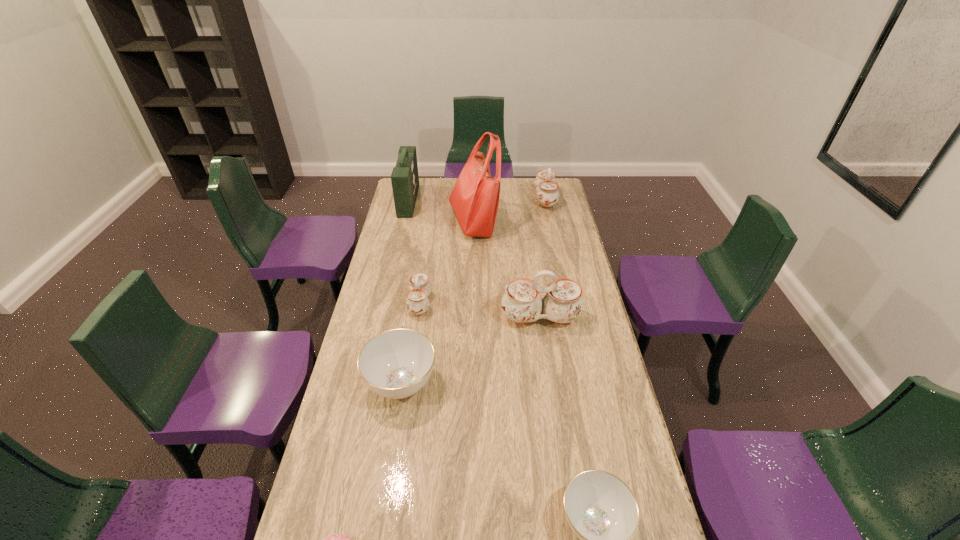
Where is `free space located on the front-facing side of the handbag`? free space located on the front-facing side of the handbag is located at coordinates (560, 222).

Find the location of a particular element. free region located 0.310m on the front-facing side of the first-aid kit is located at coordinates (475, 201).

What are the coordinates of `blank space located 0.290m by the handle of the biggest white chinaware` in the screenshot? It's located at (552, 401).

Identify the location of vacant area located by the handle of the second tallest chinaware. point(500,199).

This screenshot has width=960, height=540. I want to click on blank space located by the handle of the second tallest chinaware, so click(x=496, y=199).

This screenshot has height=540, width=960. In order to click on blank space located by the handle of the second tallest chinaware in this screenshot , I will do `click(489, 199)`.

This screenshot has width=960, height=540. Identify the location of free space located by the handle of the leftmost white chinaware. (508, 303).

At what (x,y) coordinates should I click in order to perform the action: click on free space located 0.310m on the front of the second nearest chinaware. Please return your answer as a coordinate pair (x, y). The width and height of the screenshot is (960, 540). Looking at the image, I should click on (379, 523).

Where is `the first-aid kit that is at the far edge`? the first-aid kit that is at the far edge is located at coordinates (405, 180).

Locate an element on the screen. Image resolution: width=960 pixels, height=540 pixels. chinaware situated at the far edge is located at coordinates (545, 184).